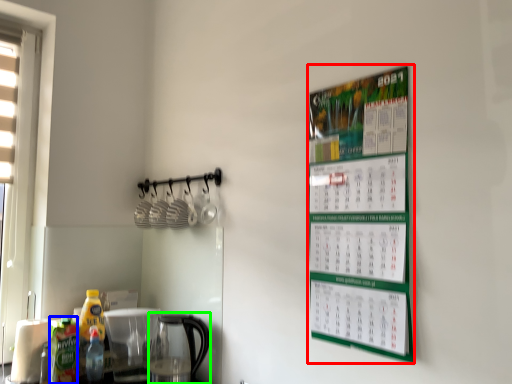
Question: Considering the real-world distances, which object is farthest from bulletin board (highlighted by a red box)? bottle (highlighted by a blue box) or coffeepot (highlighted by a green box)?

Choices:
 (A) bottle
 (B) coffeepot

Answer: (A)